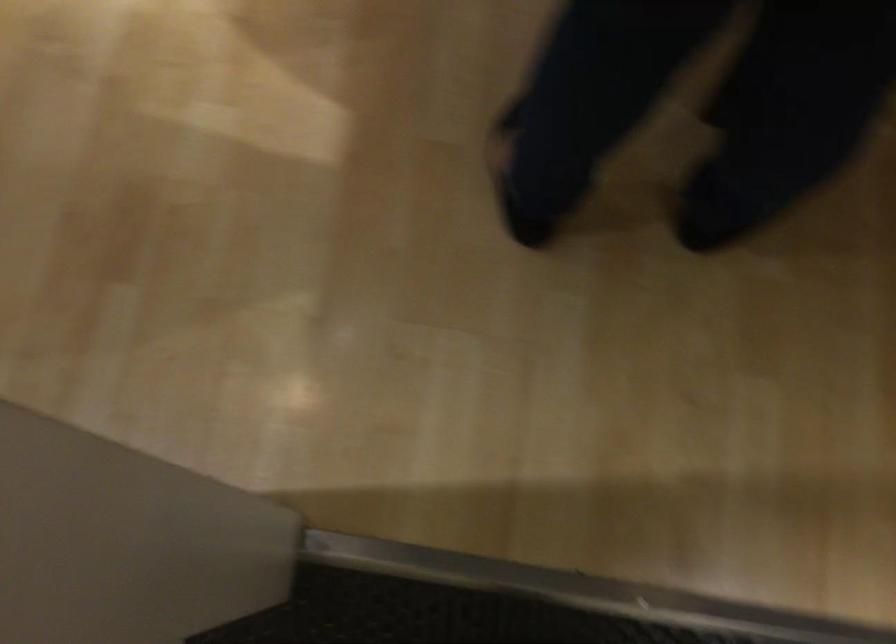
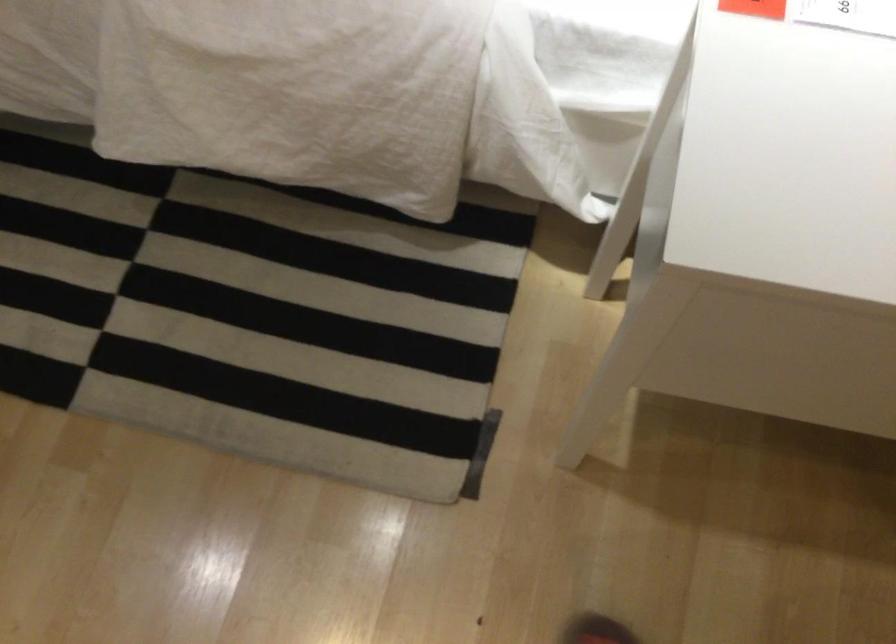
In a continuous first-person perspective shot, in which direction is the camera moving?

A: The cameraman walked toward left, backward.